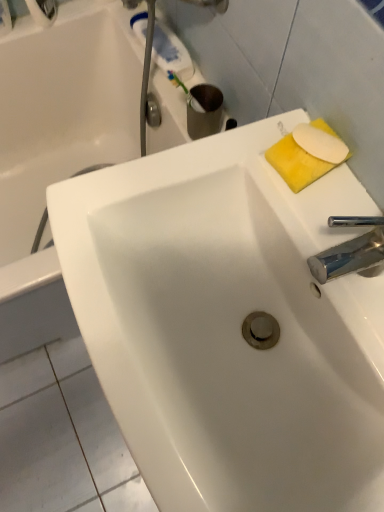
Identify the location of free space to the left of yellow sponge at upper right, placed as the 1th soap when sorted from back to front. (223, 160).